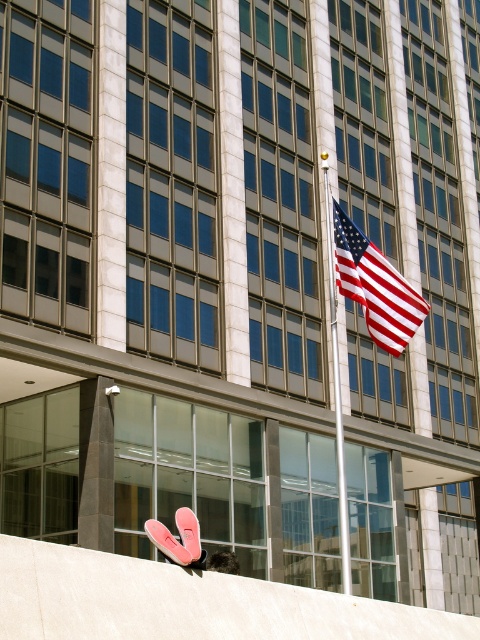
What do you see at coordinates (374, 285) in the screenshot? I see `american flag at center` at bounding box center [374, 285].

Is american flag at center bigger than white glossy flag pole at center?

Actually, american flag at center might be smaller than white glossy flag pole at center.

Does point (407, 308) lie in front of point (336, 396)?

Yes, it is.

Locate an element on the screen. Image resolution: width=480 pixels, height=640 pixels. american flag at center is located at coordinates (374, 285).